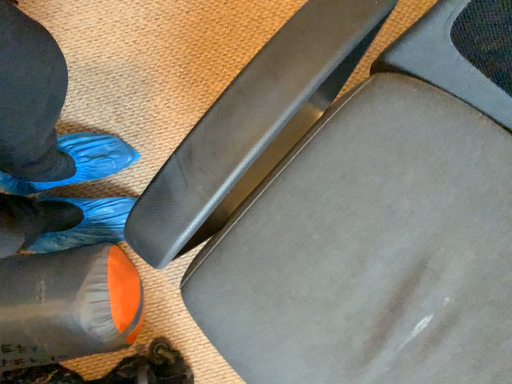
Locate an element on the screen. empty space that is ontop of orange fabric shoe at lower left (from a real-world perspective) is located at coordinates (52, 301).